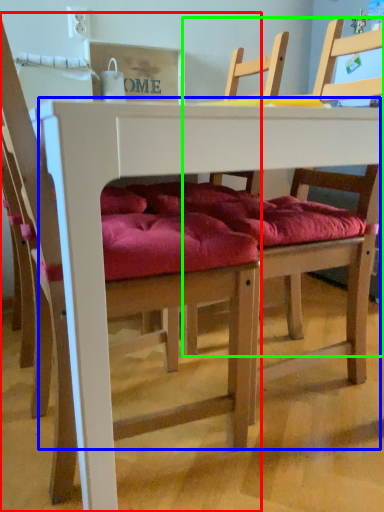
Question: Which object is positioned farthest from chair (highlighted by a red box)? Select from table (highlighted by a blue box) and chair (highlighted by a green box).

Choices:
 (A) table
 (B) chair

Answer: (B)